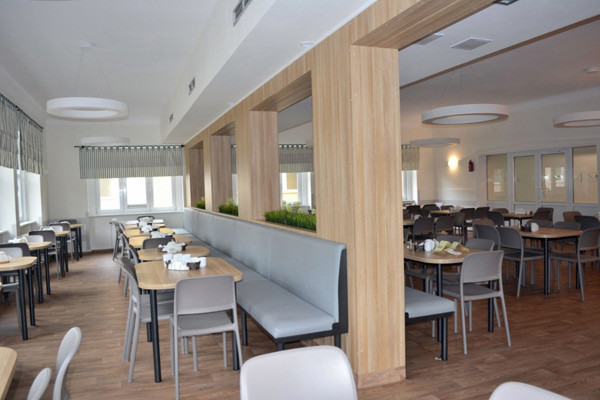
You are a GUI agent. You are given a task and a screenshot of the screen. Output one action in this format:
    pyautogui.click(x=<x>, y=<y>)
    Task: Click on the grey chairs
    This screenshot has height=400, width=600.
    Given the screenshot: What is the action you would take?
    pyautogui.click(x=67, y=349), pyautogui.click(x=37, y=376), pyautogui.click(x=296, y=366), pyautogui.click(x=208, y=309), pyautogui.click(x=138, y=311), pyautogui.click(x=515, y=390), pyautogui.click(x=484, y=276), pyautogui.click(x=515, y=241), pyautogui.click(x=486, y=229), pyautogui.click(x=424, y=225)